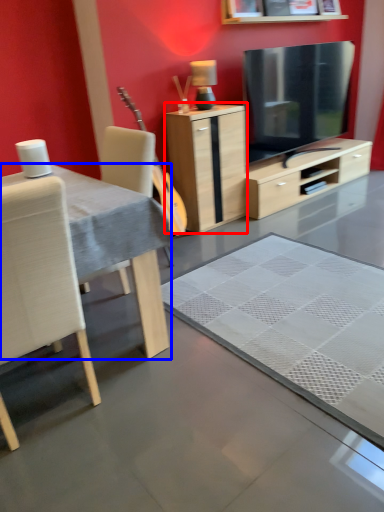
Question: Among these objects, which one is nearest to the camera, cabinetry (highlighted by a red box) or desk (highlighted by a blue box)?

Choices:
 (A) cabinetry
 (B) desk

Answer: (B)